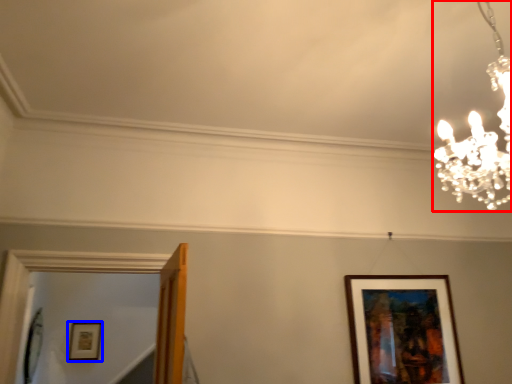
Question: Which object appears farthest to the camera in this image, lamp (highlighted by a red box) or picture frame (highlighted by a blue box)?

Choices:
 (A) lamp
 (B) picture frame

Answer: (B)